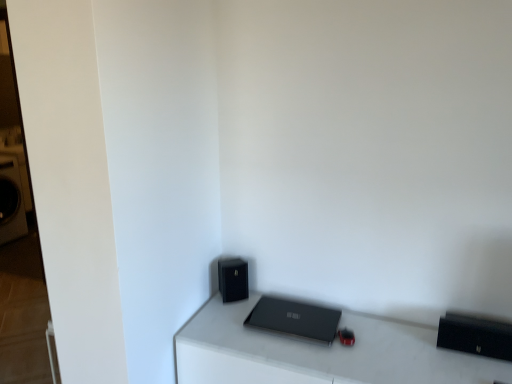
Locate an element on the screen. free space on the front side of matte black laptop at center is located at coordinates (307, 360).